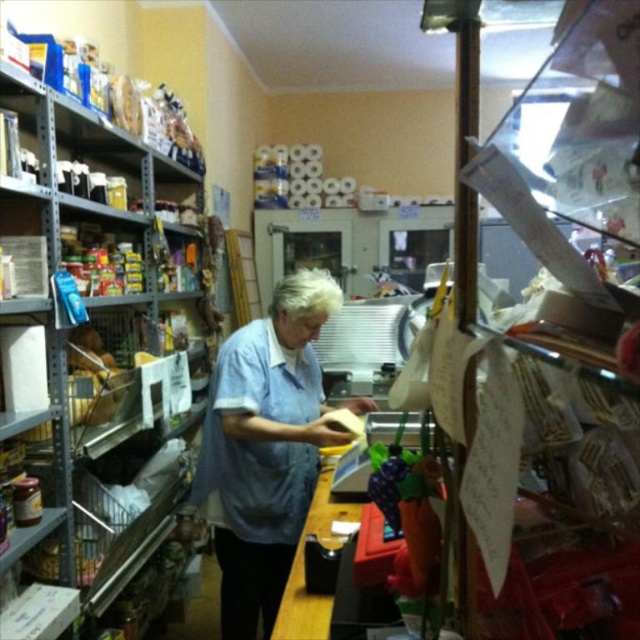
Is metallic silver shelves at left closer to camera compared to blue cotton shirt at center?

That is True.

Does metallic silver shelves at left lie behind blue cotton shirt at center?

No.

Who is more distant from viewer, (90, 451) or (253, 403)?

Positioned behind is point (90, 451).

Where is `metallic silver shelves at left`? The image size is (640, 640). metallic silver shelves at left is located at coordinates (88, 336).